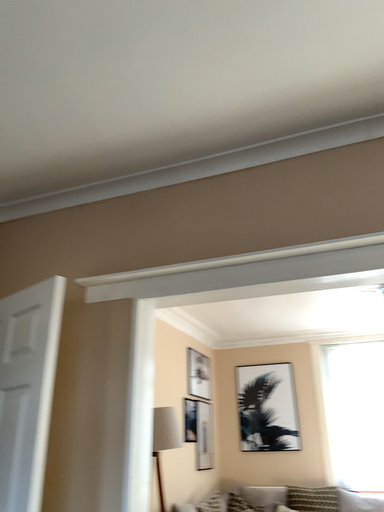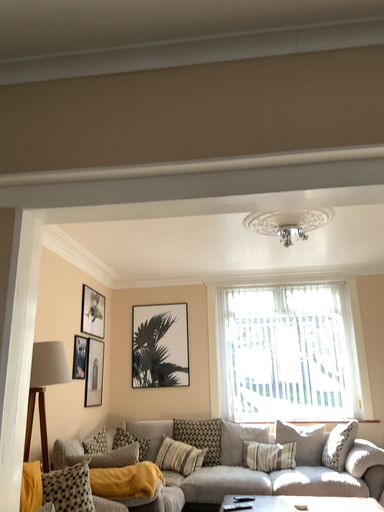
Question: Which way did the camera rotate in the video?

Choices:
 (A) rotated downward
 (B) rotated upward

Answer: (A)